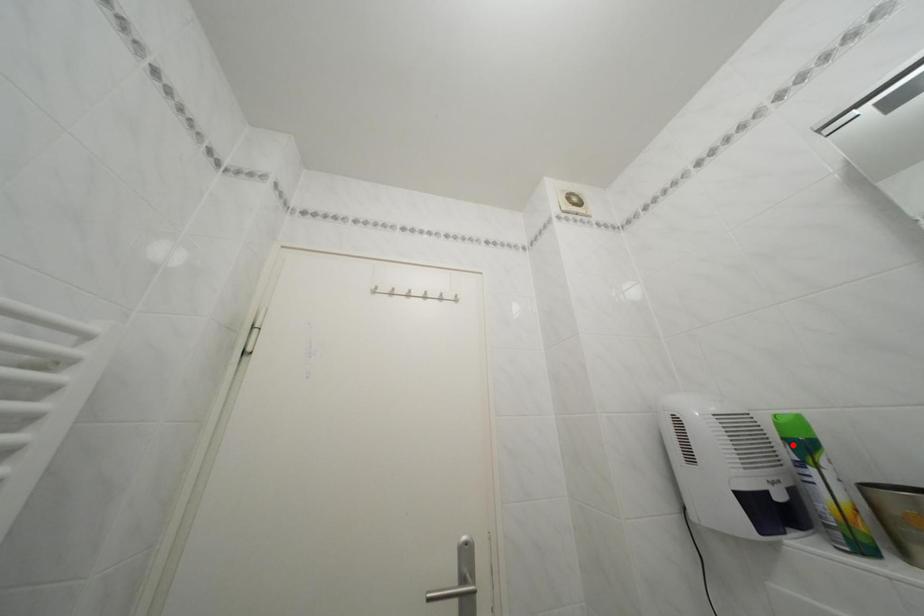
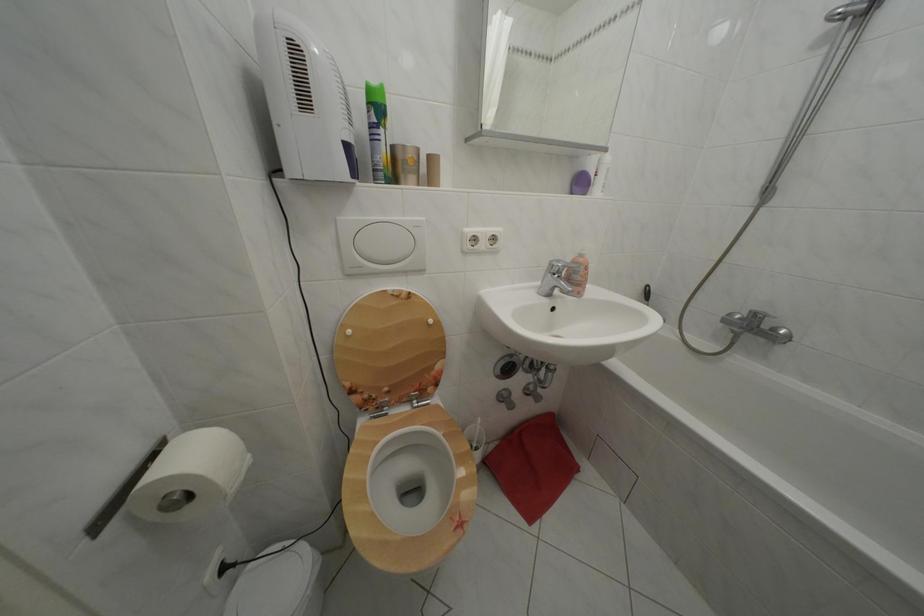
The point at the highlighted location is marked in the first image. Where is the corresponding point in the second image?

(378, 110)